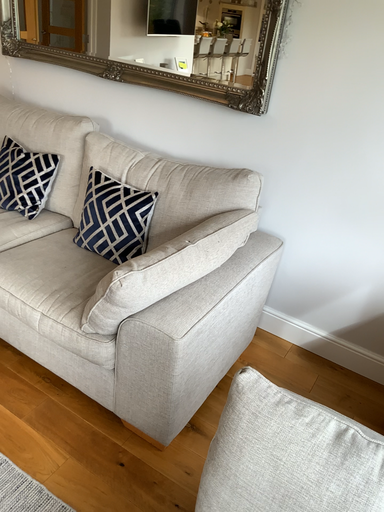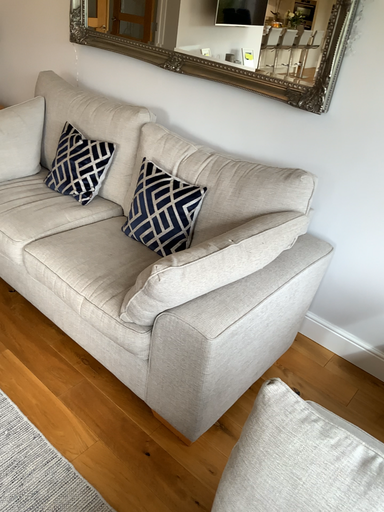
Question: How did the camera likely rotate when shooting the video?

Choices:
 (A) rotated right
 (B) rotated left

Answer: (B)